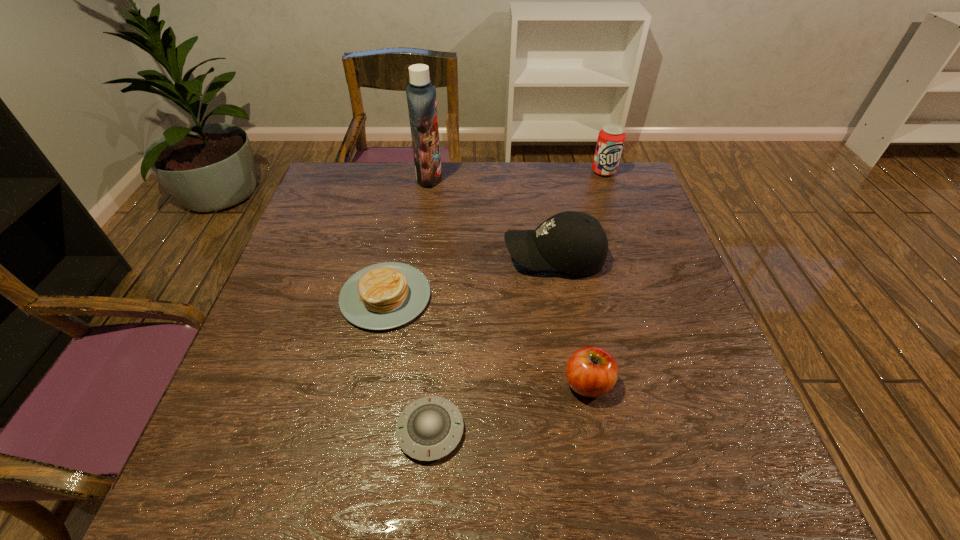
Image resolution: width=960 pixels, height=540 pixels. I want to click on free area in between the apple and the shortest object, so click(509, 407).

This screenshot has width=960, height=540. Find the location of `blank region between the pancake and the shortest object`. blank region between the pancake and the shortest object is located at coordinates (408, 363).

The width and height of the screenshot is (960, 540). Identify the location of free space between the shortest object and the shampoo. (430, 303).

Select which object appears as the fifth closest to the baseball cap. Please provide its 2D coordinates. Your answer should be formatted as a tuple, i.e. [(x, y)], where the tuple contains the x and y coordinates of a point satisfying the conditions above.

[(429, 428)]

Select which object appears as the third closest to the baseball cap. Please provide its 2D coordinates. Your answer should be formatted as a tuple, i.e. [(x, y)], where the tuple contains the x and y coordinates of a point satisfying the conditions above.

[(421, 96)]

The height and width of the screenshot is (540, 960). What are the coordinates of `vacant position in the image that satisfies the following two spatial constraints: 1. on the front-facing side of the baseball cap; 2. on the front side of the fifth tallest object` in the screenshot? It's located at (561, 296).

The width and height of the screenshot is (960, 540). I want to click on blank area in the image that satisfies the following two spatial constraints: 1. on the front label of the shampoo; 2. on the right side of the third shortest object, so click(399, 383).

Locate an element on the screen. The image size is (960, 540). blank space that satisfies the following two spatial constraints: 1. on the front-facing side of the baseball cap; 2. on the back side of the apple is located at coordinates (575, 383).

Identify the location of vacant position in the image that satisfies the following two spatial constraints: 1. on the surface of the soda can; 2. on the front label of the shampoo. (606, 177).

Where is `free region that satisfies the following two spatial constraints: 1. on the back side of the saucer; 2. on the front label of the shampoo`? The width and height of the screenshot is (960, 540). free region that satisfies the following two spatial constraints: 1. on the back side of the saucer; 2. on the front label of the shampoo is located at coordinates (451, 177).